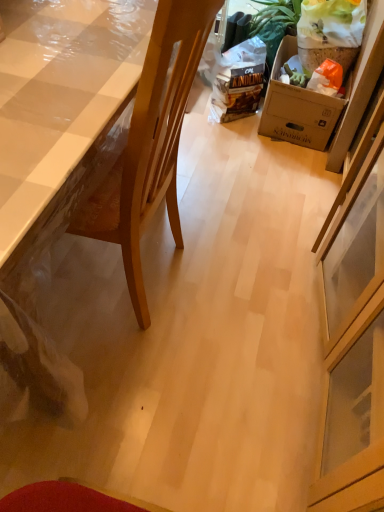
Where is `wooden chair at center`? The width and height of the screenshot is (384, 512). wooden chair at center is located at coordinates (151, 142).

The width and height of the screenshot is (384, 512). What do you see at coordinates (151, 142) in the screenshot? I see `wooden chair at center` at bounding box center [151, 142].

In order to face wooden chair at center, should I rotate leftwards or rightwards?

It's best to rotate left around 10.585 degrees.

Find the location of a particular element. The width and height of the screenshot is (384, 512). wooden chair at center is located at coordinates (151, 142).